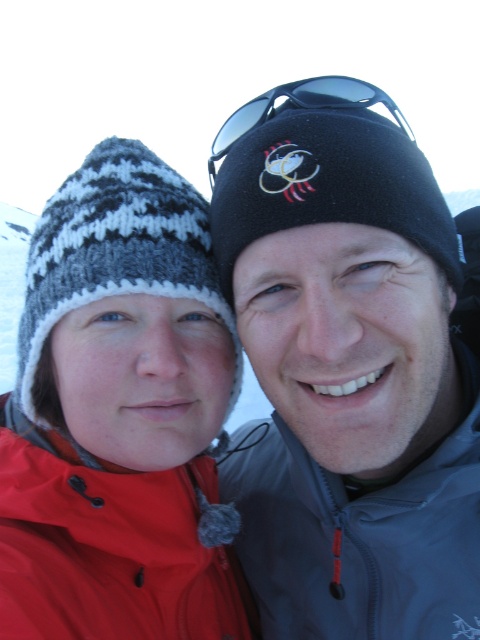
Question: Which of the following is the closest to the observer?

Choices:
 (A) knitted woolen hat at left
 (B) gray synthetic jacket at right
 (C) matte red jacket at lower left
 (D) sunglasses at upper center

Answer: (C)

Question: Based on their relative distances, which object is nearer to the gray synthetic jacket at right?

Choices:
 (A) knitted woolen hat at left
 (B) black fleece beanie at upper center

Answer: (A)

Question: Considering the real-world distances, which object is farthest from the matte red jacket at lower left?

Choices:
 (A) black fleece beanie at upper center
 (B) knitted woolen hat at left

Answer: (A)

Question: Is black fleece beanie at upper center positioned behind sunglasses at upper center?

Choices:
 (A) no
 (B) yes

Answer: (A)

Question: From the image, what is the correct spatial relationship of gray synthetic jacket at right in relation to matte red jacket at lower left?

Choices:
 (A) right
 (B) left

Answer: (A)

Question: Does knitted woolen hat at left appear over black fleece beanie at upper center?

Choices:
 (A) yes
 (B) no

Answer: (B)